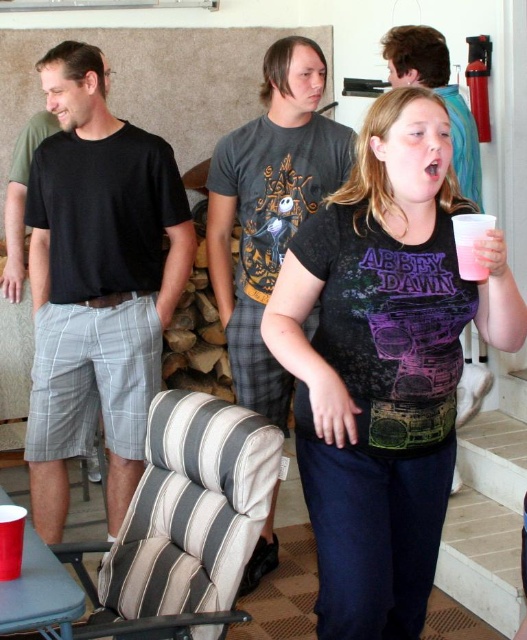
You are standing in the room and want to reach a point that is 5.49 feet away from you. Is the point at coordinates point (x=453, y=234) within your reach?

The distance of point (x=453, y=234) from viewer is 5.49 feet, so yes, the point at coordinates point (x=453, y=234) is exactly 5.49 feet away from you, which means it is within your reach.